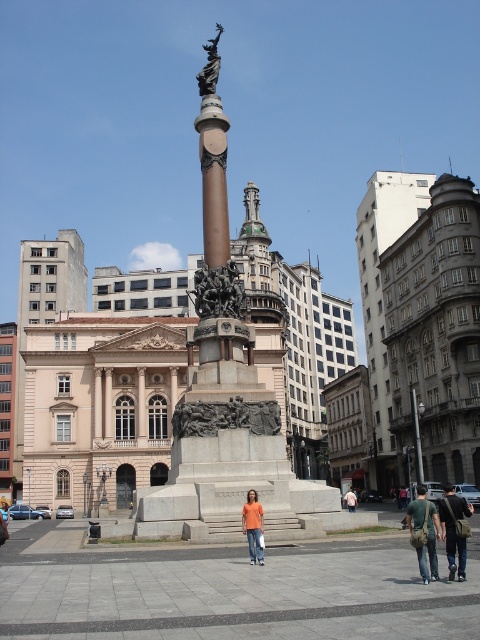
Which is more to the left, green canvas bag at lower right or orange shirt at center?

orange shirt at center is more to the left.

Can you confirm if green canvas bag at lower right is shorter than orange shirt at center?

Yes.

Image resolution: width=480 pixels, height=640 pixels. Identify the location of green canvas bag at lower right. (428, 532).

Identify the location of green canvas bag at lower right. (428, 532).

Which of these two, bronze statue at center or orange cotton shirt at center, stands taller?

Standing taller between the two is bronze statue at center.

Can you confirm if bronze statue at center is positioned to the right of orange cotton shirt at center?

In fact, bronze statue at center is to the left of orange cotton shirt at center.

Does point (197, 76) lie in front of point (348, 506)?

No, (197, 76) is behind (348, 506).

I want to click on bronze statue at center, so click(210, 65).

Locate an element on the screen. This screenshot has height=640, width=480. dark blue jeans at lower right is located at coordinates (454, 529).

In the scene shown: Does dark blue jeans at lower right lie behind bronze statue at center?

No.

Which is behind, point (460, 568) or point (217, 28)?

The point (217, 28) is more distant.

Locate an element on the screen. dark blue jeans at lower right is located at coordinates (454, 529).